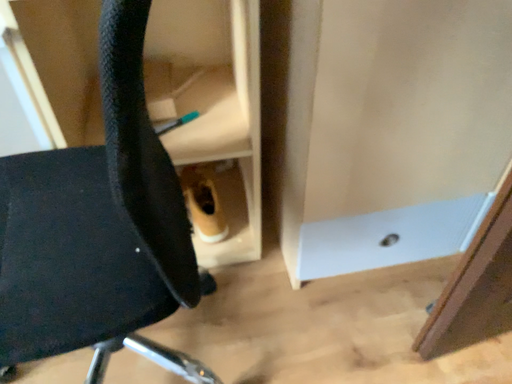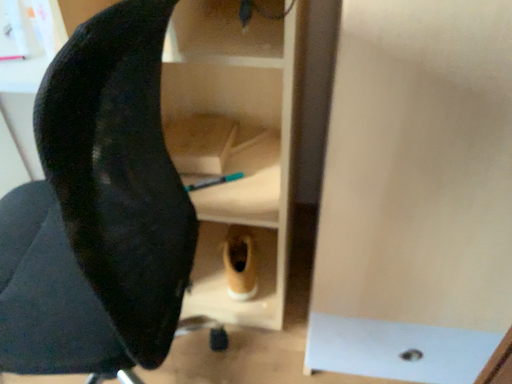
Question: Which way did the camera rotate in the video?

Choices:
 (A) rotated upward
 (B) rotated downward

Answer: (A)